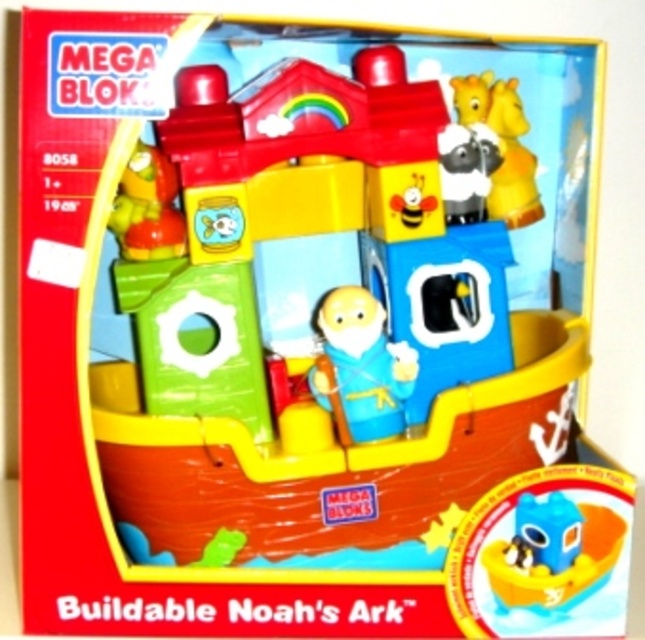
Question: Does blue plastic boat at center have a smaller size compared to smooth plastic pirate hat at upper left?

Choices:
 (A) no
 (B) yes

Answer: (B)

Question: Based on their relative distances, which object is nearer to the white plush sheep at upper center?

Choices:
 (A) smooth plastic pirate hat at upper left
 (B) blue plastic boat at center

Answer: (A)

Question: Where is blue matte noah figure at center located in relation to smooth plastic pirate hat at upper left in the image?

Choices:
 (A) above
 (B) below

Answer: (B)

Question: Is blue plastic boat at center smaller than smooth plastic pirate hat at upper left?

Choices:
 (A) yes
 (B) no

Answer: (A)

Question: Which point is farther to the camera?

Choices:
 (A) (166, 172)
 (B) (362, 308)
 (C) (471, 134)
 (D) (608, 534)

Answer: (C)

Question: Which of the following is the closest to the observer?

Choices:
 (A) blue matte noah figure at center
 (B) smooth plastic pirate hat at upper left
 (C) blue plastic boat at center

Answer: (C)